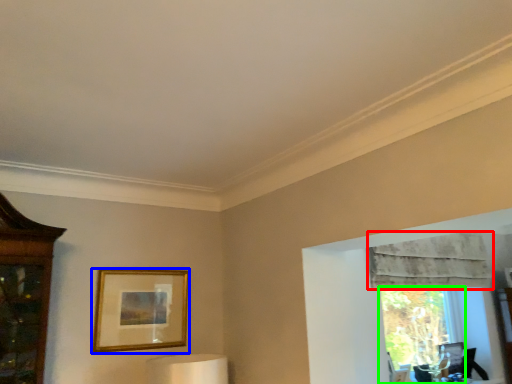
Question: Which is farther away from curtain (highlighted by a red box)? picture frame (highlighted by a blue box) or window (highlighted by a green box)?

Choices:
 (A) picture frame
 (B) window

Answer: (A)